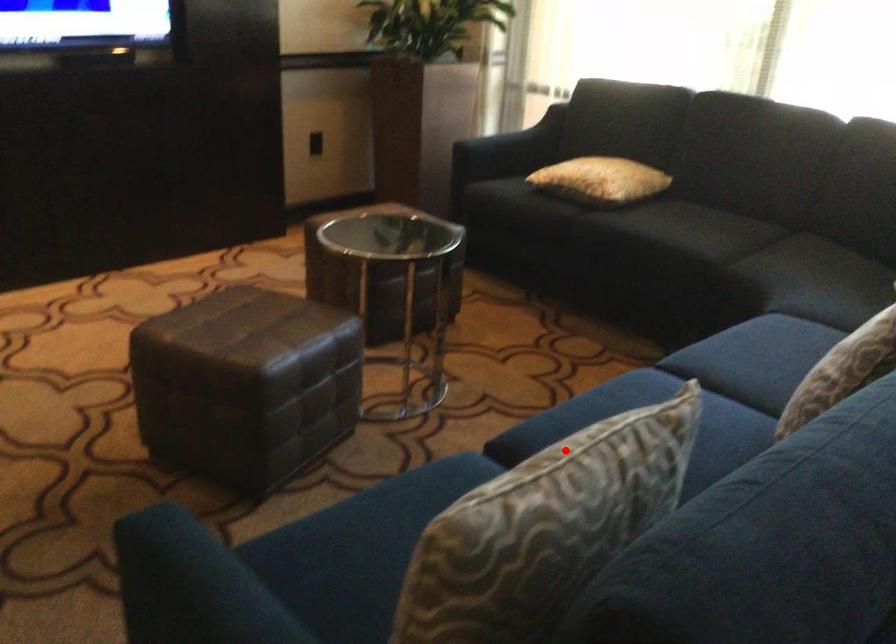
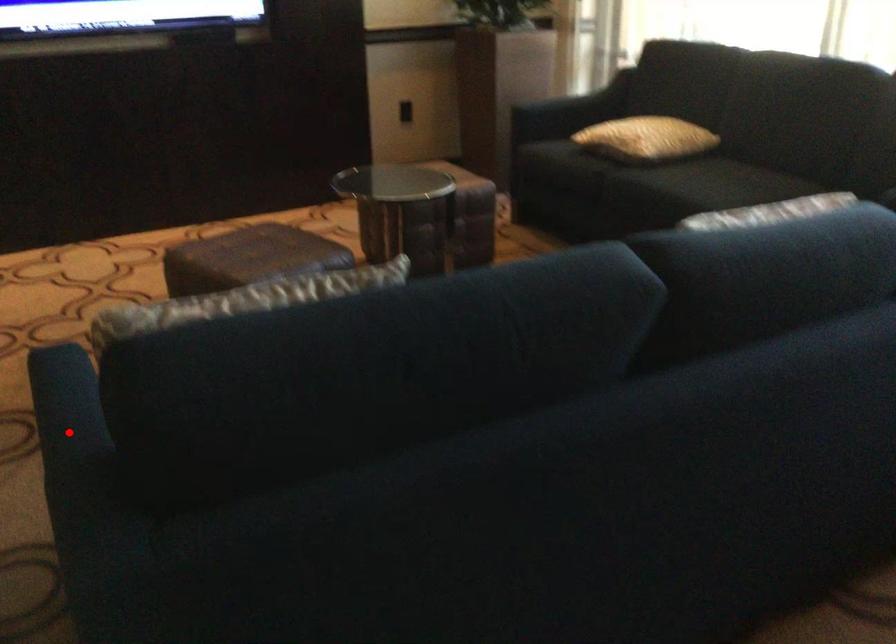
I am providing you with two images of the same scene from different viewpoints. A red point is marked on the first image and another point is marked on the second image. Is the red point in image1 aligned with the point shown in image2?

No